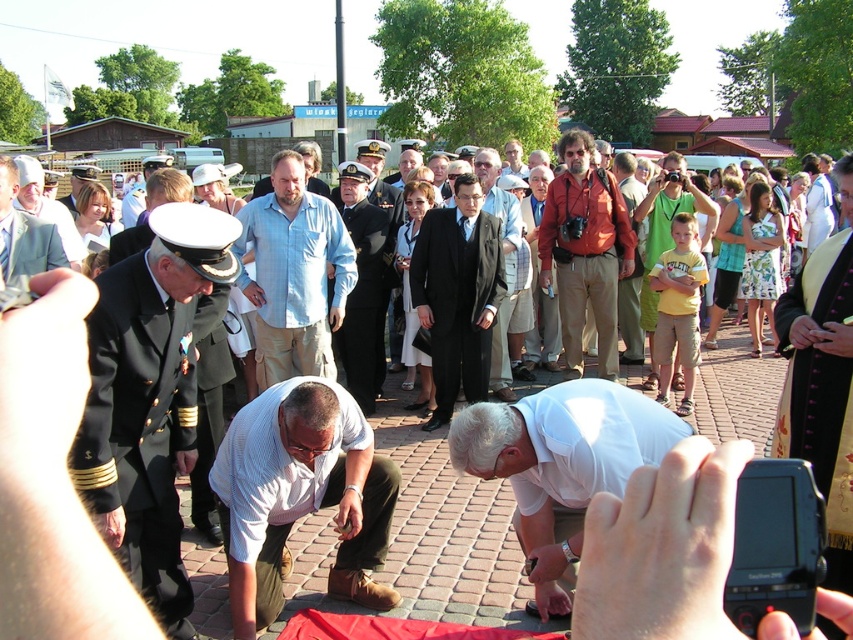
In the scene shown: You are a photographer at the event and need to capture a photo that includes both the dark blue uniform at center and the matte orange jacket at center. Based on their positions, which one should you focus on first to ensure both are in frame?

The dark blue uniform at center is located below the matte orange jacket at center, so you should focus on the matte orange jacket at center first to ensure both are in frame.

You are a photographer at the event and want to capture a photo of both the dark blue uniform at center and the matte orange jacket at center. Based on their positions, which one should you focus on first to ensure both are in frame?

The dark blue uniform at center is positioned on the left side of matte orange jacket at center, so focusing on the matte orange jacket at center first would allow the photographer to include both in the frame as they adjust the camera angle to the left.

Consider the image. You are a photographer positioned at the edge of the paved area. You need to capture a photo that includes both the matte orange jacket at center and the light gray suit at center. Given that your camera has a maximum focus range of 5 meters, will you be able to include both subjects in the same frame without moving your position?

The matte orange jacket at center is 5.12 meters away from the light gray suit at center. Since the distance between them exceeds the camera maximum focus range of 5 meters, you cannot include both subjects in the same frame without moving your position.